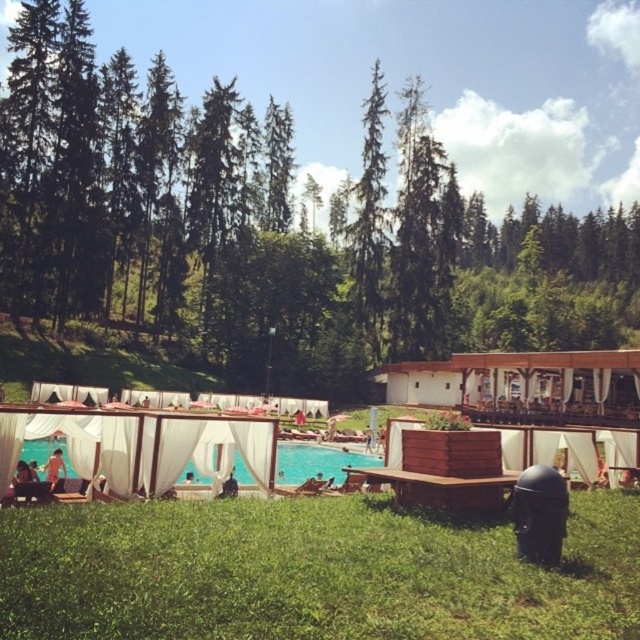
You are standing at the edge of the swimming pool and want to walk to the black trash bin on the right side. There are two points marked on the path you need to cross. Which point, point 1 at coordinates (348, 547) or point 2 at coordinates (54, 461), is closer to you as you start walking towards the trash bin?

Point 1 at coordinates (348, 547) is closer to you because it is nearer to the viewer compared to point 2 at coordinates (54, 461).

You are a guest staying at this resort and want to place a small potted plant between the green grass at lower center and the light brown wooden bench at lower left. Based on their sizes, will the space between them be sufficient for the plant?

The green grass at lower center is smaller than the light brown wooden bench at lower left, so the space between them should be sufficient to place a small potted plant.

You are standing at the entrance of the resort and want to take a photo of the green textured tree at center. Which direction should you face to ensure the tree is in the center of your photo?

The green textured tree at center is located at point (x=369, y=221), so facing towards the center area where the tree is positioned will ensure it is centered in your photo.